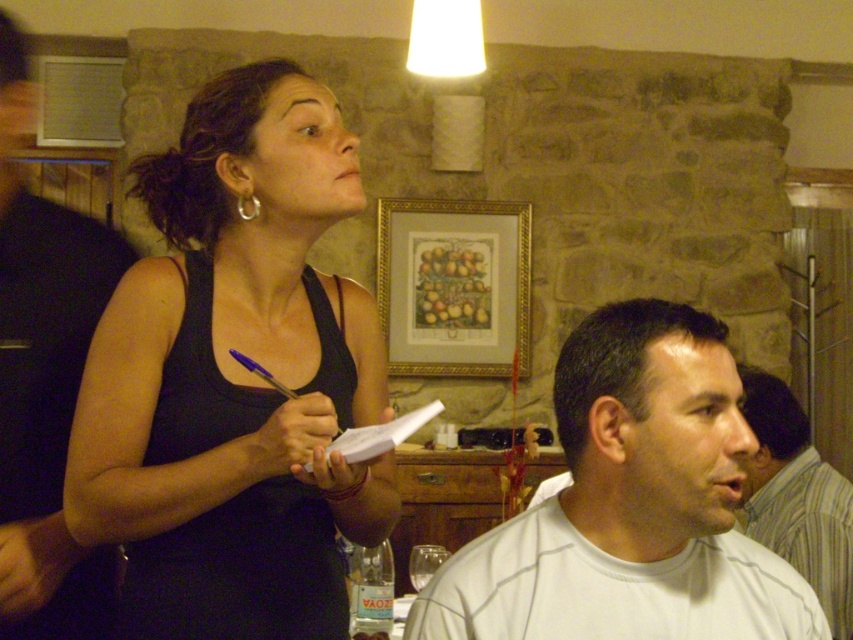
Question: Is black fabric tank top at upper left wider than gold/gilded picture frame at upper center?

Choices:
 (A) no
 (B) yes

Answer: (A)

Question: Among these objects, which one is farthest from the camera?

Choices:
 (A) white cotton shirt at lower right
 (B) gold/gilded picture frame at upper center
 (C) black fabric tank top at upper left

Answer: (B)

Question: Does white matte shirt at upper right have a lesser width compared to white cotton shirt at lower right?

Choices:
 (A) yes
 (B) no

Answer: (A)

Question: Which of the following is the closest to the observer?

Choices:
 (A) (802, 480)
 (B) (430, 621)

Answer: (B)

Question: Which object is the closest to the white matte shirt at lower right?

Choices:
 (A) gold/gilded picture frame at upper center
 (B) white matte shirt at upper right
 (C) white cotton shirt at lower right
 (D) black fabric tank top at upper left

Answer: (D)

Question: In this image, where is white matte shirt at lower right located relative to gold/gilded picture frame at upper center?

Choices:
 (A) left
 (B) right

Answer: (B)